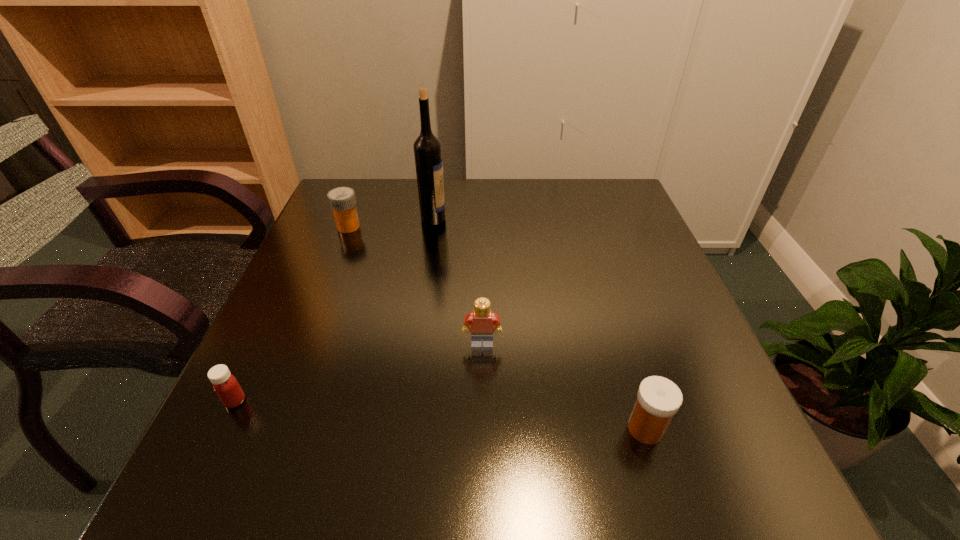
Identify the location of vacant point that satisfies the following two spatial constraints: 1. on the front side of the rightmost medicine; 2. on the left side of the shortest medicine. The width and height of the screenshot is (960, 540). click(x=222, y=429).